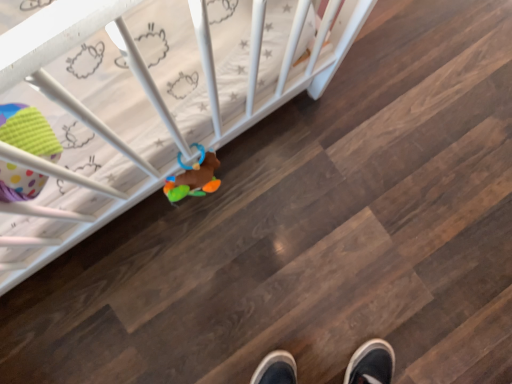
Question: Is multicolored plush toy at center, placed as the 1th toy when sorted from right to left, completely or partially outside of white plastic crib at upper left?

Choices:
 (A) yes
 (B) no

Answer: (A)

Question: From the image's perspective, is multicolored plush toy at center, placed as the second toy when sorted from left to right, located above white plastic crib at upper left?

Choices:
 (A) no
 (B) yes

Answer: (A)

Question: Considering the relative sizes of multicolored plush toy at center, which is the second toy in front-to-back order, and white plastic crib at upper left in the image provided, is multicolored plush toy at center, which is the second toy in front-to-back order, smaller than white plastic crib at upper left?

Choices:
 (A) no
 (B) yes

Answer: (B)

Question: From the image's perspective, is multicolored plush toy at center, the 1th toy when ordered from back to front, below white plastic crib at upper left?

Choices:
 (A) no
 (B) yes

Answer: (B)

Question: Does multicolored plush toy at center, placed as the 1th toy when sorted from right to left, have a lesser height compared to white plastic crib at upper left?

Choices:
 (A) yes
 (B) no

Answer: (B)

Question: Is white plastic crib at upper left to the left or to the right of multicolored plush toy at center, which is the second toy in front-to-back order, in the image?

Choices:
 (A) left
 (B) right

Answer: (B)

Question: Considering their positions, is white plastic crib at upper left located in front of or behind multicolored plush toy at center, which is the second toy in front-to-back order?

Choices:
 (A) behind
 (B) front

Answer: (A)

Question: Looking at the image, does white plastic crib at upper left seem bigger or smaller compared to multicolored plush toy at center, placed as the second toy when sorted from left to right?

Choices:
 (A) big
 (B) small

Answer: (A)

Question: From the image's perspective, is white plastic crib at upper left positioned above or below multicolored plush toy at center, the 1th toy when ordered from back to front?

Choices:
 (A) above
 (B) below

Answer: (A)

Question: Considering their positions, is white plastic crib at upper left located in front of or behind polka dot fabric toy at left, acting as the 2th toy starting from the back?

Choices:
 (A) behind
 (B) front

Answer: (A)

Question: Considering the positions of white plastic crib at upper left and polka dot fabric toy at left, marked as the first toy in a left-to-right arrangement, in the image, is white plastic crib at upper left bigger or smaller than polka dot fabric toy at left, marked as the first toy in a left-to-right arrangement,?

Choices:
 (A) small
 (B) big

Answer: (B)

Question: Is white plastic crib at upper left inside the boundaries of polka dot fabric toy at left, which is counted as the first toy, starting from the front, or outside?

Choices:
 (A) inside
 (B) outside

Answer: (B)

Question: Considering the positions of white plastic crib at upper left and polka dot fabric toy at left, marked as the first toy in a left-to-right arrangement, in the image, is white plastic crib at upper left wider or thinner than polka dot fabric toy at left, marked as the first toy in a left-to-right arrangement,?

Choices:
 (A) wide
 (B) thin

Answer: (A)

Question: Considering the positions of point (202, 187) and point (49, 155), is point (202, 187) closer or farther from the camera than point (49, 155)?

Choices:
 (A) closer
 (B) farther

Answer: (B)

Question: From the image's perspective, is multicolored plush toy at center, the 1th toy when ordered from back to front, positioned above or below polka dot fabric toy at left, marked as the first toy in a left-to-right arrangement?

Choices:
 (A) above
 (B) below

Answer: (B)